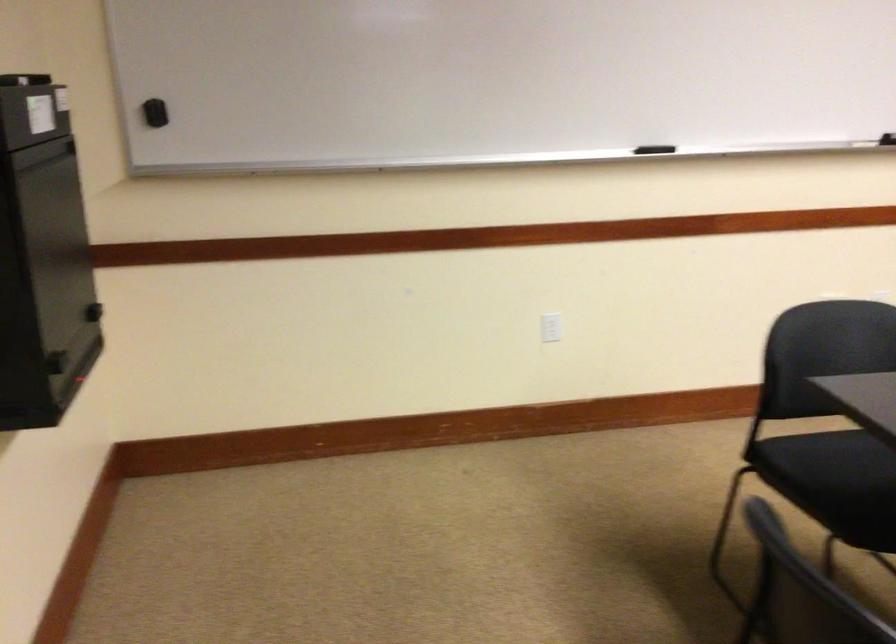
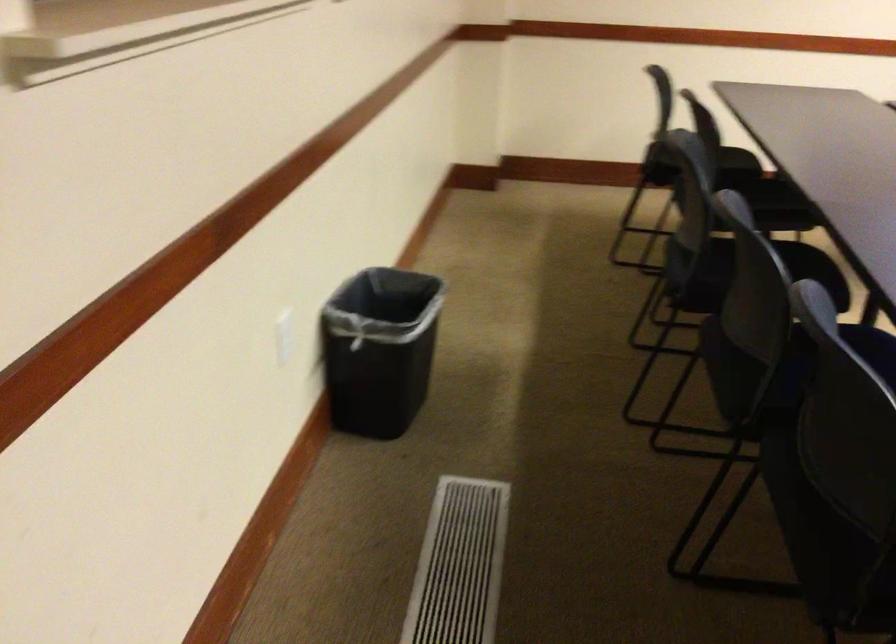
Question: Which direction would the cameraman need to move to produce the second image? Reply with the corresponding letter.

Choices:
 (A) Left
 (B) Right
 (C) Forward
 (D) Backward

Answer: (D)